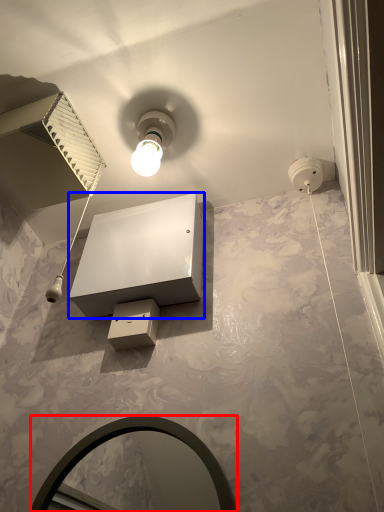
Question: Among these objects, which one is nearest to the camera, mirror (highlighted by a red box) or vanity (highlighted by a blue box)?

Choices:
 (A) mirror
 (B) vanity

Answer: (A)